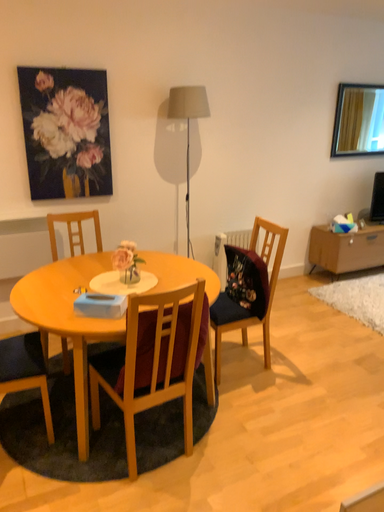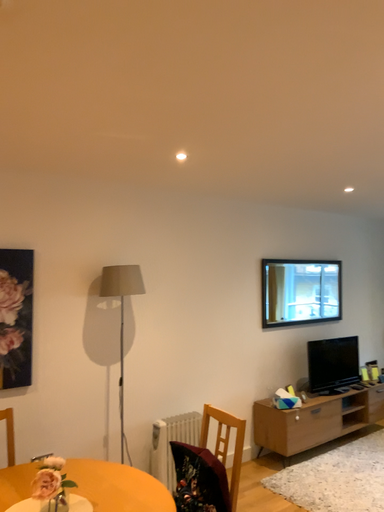
Question: Which way did the camera rotate in the video?

Choices:
 (A) rotated right
 (B) rotated left

Answer: (A)